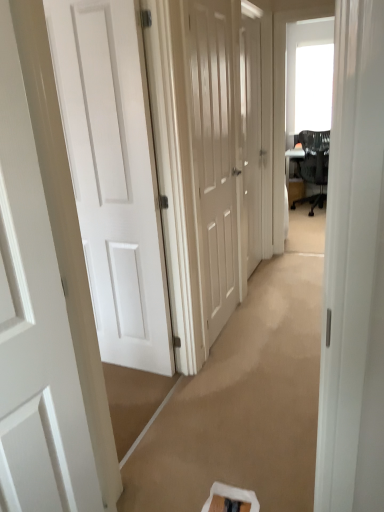
Question: In which direction should I rotate to look at matte white door at center, the third door viewed from the front?

Choices:
 (A) right
 (B) left

Answer: (A)

Question: Is there a large distance between white glossy door at center, which appears as the 1th door when viewed from the back, and white glossy door at left, which is the fourth door in back-to-front order?

Choices:
 (A) no
 (B) yes

Answer: (B)

Question: Would you say white glossy door at center, which appears as the 1th door when viewed from the back, contains white glossy door at left, the first door viewed from the front?

Choices:
 (A) no
 (B) yes

Answer: (A)

Question: From the image's perspective, is white glossy door at center, which is the 4th door in front-to-back order, over white glossy door at left, the first door viewed from the front?

Choices:
 (A) no
 (B) yes

Answer: (B)

Question: Is white glossy door at center, which appears as the 1th door when viewed from the back, outside white glossy door at left, which is the fourth door in back-to-front order?

Choices:
 (A) yes
 (B) no

Answer: (A)

Question: Can you confirm if white glossy door at center, which appears as the 1th door when viewed from the back, is shorter than white glossy door at left, which is the fourth door in back-to-front order?

Choices:
 (A) no
 (B) yes

Answer: (A)

Question: From a real-world perspective, is white glossy door at center, which appears as the 1th door when viewed from the back, positioned under white glossy door at left, the first door viewed from the front, based on gravity?

Choices:
 (A) no
 (B) yes

Answer: (A)

Question: From the image's perspective, is black mesh chair at upper right below matte white door at center, which is the 2th door in back-to-front order?

Choices:
 (A) yes
 (B) no

Answer: (B)

Question: Does black mesh chair at upper right have a lesser height compared to matte white door at center, which is the 2th door in back-to-front order?

Choices:
 (A) yes
 (B) no

Answer: (A)

Question: Is black mesh chair at upper right wider than matte white door at center, which is the 2th door in back-to-front order?

Choices:
 (A) no
 (B) yes

Answer: (B)

Question: Is black mesh chair at upper right in front of matte white door at center, which is the 2th door in back-to-front order?

Choices:
 (A) yes
 (B) no

Answer: (B)

Question: Can you confirm if black mesh chair at upper right is positioned to the right of matte white door at center, which is the 2th door in back-to-front order?

Choices:
 (A) no
 (B) yes

Answer: (B)

Question: Is black mesh chair at upper right thinner than matte white door at center, which is the 2th door in back-to-front order?

Choices:
 (A) yes
 (B) no

Answer: (B)

Question: Is black mesh chair at upper right in front of white matte door at left, which is the third door in back-to-front order?

Choices:
 (A) yes
 (B) no

Answer: (B)